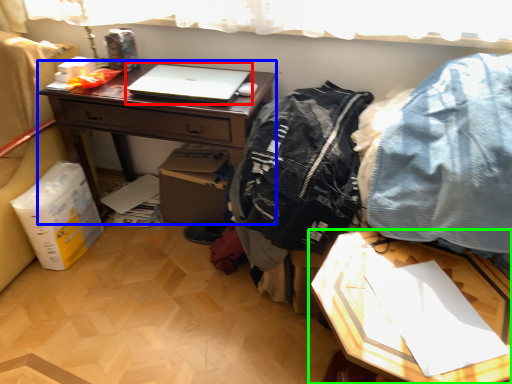
Question: Considering the real-world distances, which object is farthest from laptop (highlighted by a red box)? desk (highlighted by a blue box) or table (highlighted by a green box)?

Choices:
 (A) desk
 (B) table

Answer: (B)